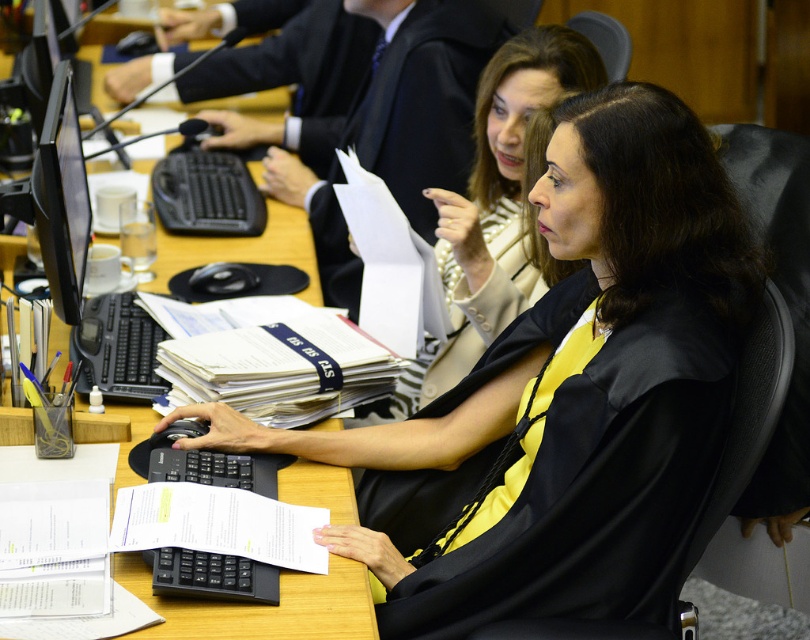
Question: Which object is farther from the camera taking this photo?

Choices:
 (A) white paper at center
 (B) white paper at lower center

Answer: (A)

Question: Which object is farther from the camera taking this photo?

Choices:
 (A) white paper at center
 (B) yellow fabric jacket at center
 (C) black plastic keyboard at center

Answer: (C)

Question: Is black plastic monitor at left behind black plastic keyboard at center?

Choices:
 (A) yes
 (B) no

Answer: (B)

Question: Does white paper at center appear over black plastic keyboard at left?

Choices:
 (A) yes
 (B) no

Answer: (A)

Question: Which is farther from the yellow fabric jacket at center?

Choices:
 (A) black glossy monitor at left
 (B) wooden table at center

Answer: (A)

Question: Can you confirm if white paper at center is positioned above black plastic keyboard at center?

Choices:
 (A) yes
 (B) no

Answer: (B)